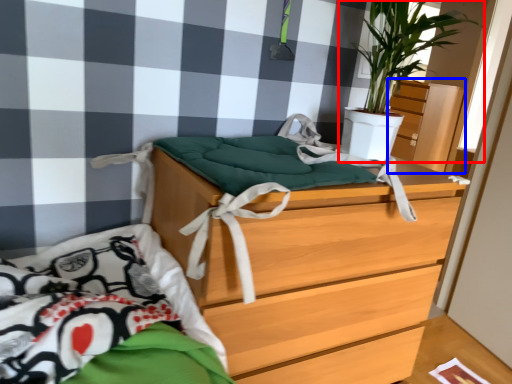
Question: Which of the following is the farthest to the observer, houseplant (highlighted by a red box) or dresser (highlighted by a blue box)?

Choices:
 (A) houseplant
 (B) dresser

Answer: (B)